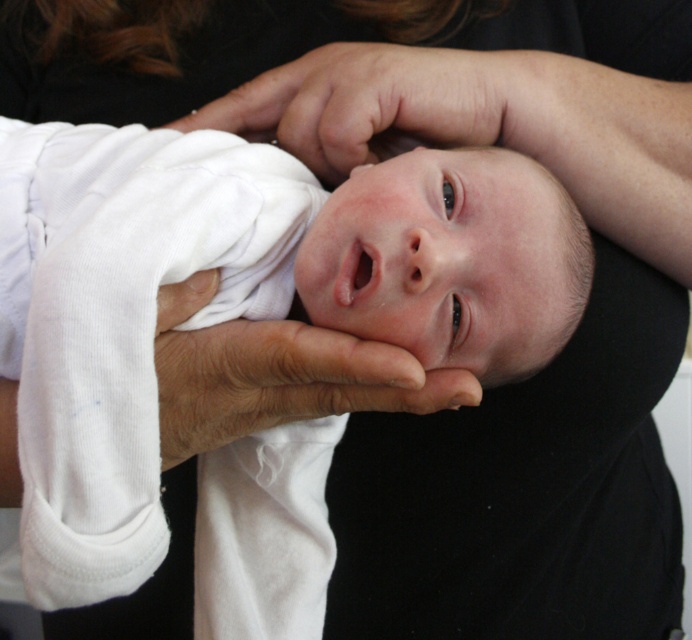
Question: Which point appears closest to the camera in this image?

Choices:
 (A) (201, 346)
 (B) (346, 65)

Answer: (A)

Question: Which of the following is the farthest from the observer?

Choices:
 (A) (217, 284)
 (B) (318, 76)

Answer: (B)

Question: Which of the following is the closest to the observer?

Choices:
 (A) smooth skin hand at center
 (B) dry skin hand at center

Answer: (B)

Question: Can you confirm if dry skin hand at center is thinner than smooth skin hand at center?

Choices:
 (A) no
 (B) yes

Answer: (B)

Question: Is the position of dry skin hand at center less distant than that of smooth skin hand at center?

Choices:
 (A) yes
 (B) no

Answer: (A)

Question: Does dry skin hand at center have a greater width compared to smooth skin hand at center?

Choices:
 (A) yes
 (B) no

Answer: (B)